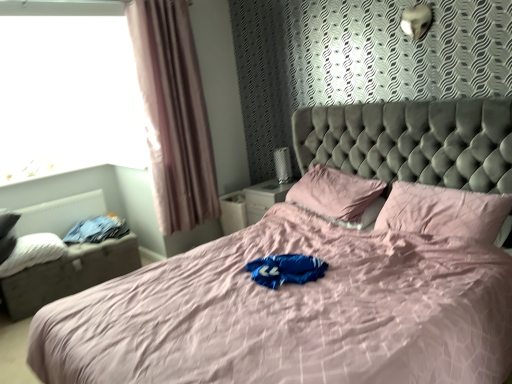
Question: Considering the relative sizes of pink fabric pillow at center, which is counted as the second pillow, starting from the left, and pink fabric pillow at upper right, acting as the third pillow starting from the left, in the image provided, is pink fabric pillow at center, which is counted as the second pillow, starting from the left, smaller than pink fabric pillow at upper right, acting as the third pillow starting from the left,?

Choices:
 (A) no
 (B) yes

Answer: (A)

Question: Does pink fabric pillow at center, which is the 2th pillow from right to left, turn towards pink fabric pillow at upper right, positioned as the first pillow in right-to-left order?

Choices:
 (A) no
 (B) yes

Answer: (A)

Question: Can you confirm if pink fabric pillow at center, which is counted as the second pillow, starting from the left, is shorter than pink fabric pillow at upper right, acting as the third pillow starting from the left?

Choices:
 (A) yes
 (B) no

Answer: (B)

Question: From the image's perspective, does pink fabric pillow at center, which is the 2th pillow from right to left, appear lower than pink fabric pillow at upper right, acting as the third pillow starting from the left?

Choices:
 (A) no
 (B) yes

Answer: (A)

Question: Does pink fabric pillow at center, which is counted as the second pillow, starting from the left, have a lesser width compared to pink fabric pillow at upper right, positioned as the first pillow in right-to-left order?

Choices:
 (A) no
 (B) yes

Answer: (A)

Question: From a real-world perspective, is white textured radiator at left positioned above or below pink fabric pillow at center, which is the 2th pillow from right to left?

Choices:
 (A) below
 (B) above

Answer: (A)

Question: Would you say white textured radiator at left is inside or outside pink fabric pillow at center, which is the 2th pillow from right to left?

Choices:
 (A) inside
 (B) outside

Answer: (B)

Question: From the image's perspective, is white textured radiator at left located above or below pink fabric pillow at center, which is counted as the second pillow, starting from the left?

Choices:
 (A) above
 (B) below

Answer: (B)

Question: Would you say white textured radiator at left is to the left or to the right of pink fabric pillow at center, which is the 2th pillow from right to left, in the picture?

Choices:
 (A) right
 (B) left

Answer: (B)

Question: Is pink fabric pillow at center, which is counted as the second pillow, starting from the left, taller or shorter than pink fabric pillow at upper right, acting as the third pillow starting from the left?

Choices:
 (A) short
 (B) tall

Answer: (B)

Question: Relative to pink fabric pillow at upper right, positioned as the first pillow in right-to-left order, is pink fabric pillow at center, which is counted as the second pillow, starting from the left, in front or behind?

Choices:
 (A) front
 (B) behind

Answer: (B)

Question: Is pink fabric pillow at center, which is counted as the second pillow, starting from the left, wider or thinner than pink fabric pillow at upper right, positioned as the first pillow in right-to-left order?

Choices:
 (A) thin
 (B) wide

Answer: (B)

Question: From a real-world perspective, relative to pink fabric pillow at upper right, acting as the third pillow starting from the left, is pink fabric pillow at center, which is counted as the second pillow, starting from the left, vertically above or below?

Choices:
 (A) above
 (B) below

Answer: (A)

Question: Considering the positions of point (336, 193) and point (94, 201), is point (336, 193) closer or farther from the camera than point (94, 201)?

Choices:
 (A) closer
 (B) farther

Answer: (A)

Question: Considering the positions of pink fabric pillow at center, which is counted as the second pillow, starting from the left, and white textured radiator at left in the image, is pink fabric pillow at center, which is counted as the second pillow, starting from the left, taller or shorter than white textured radiator at left?

Choices:
 (A) short
 (B) tall

Answer: (B)